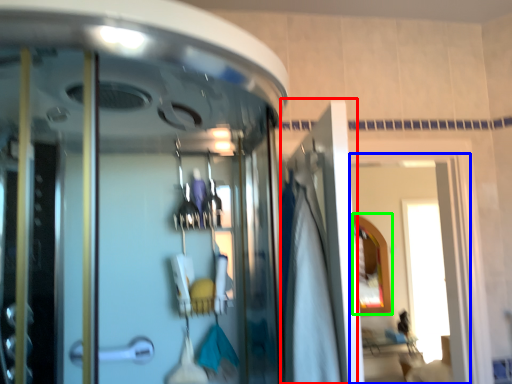
Question: Which is farther away from door (highlighted by a red box)? window (highlighted by a blue box) or mirror (highlighted by a green box)?

Choices:
 (A) window
 (B) mirror

Answer: (A)